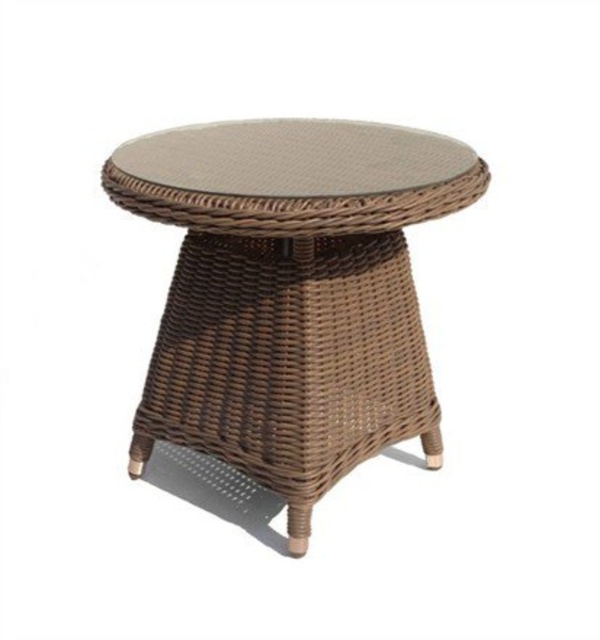
Question: Is brown woven side table at center to the right of brown woven table at center from the viewer's perspective?

Choices:
 (A) yes
 (B) no

Answer: (B)

Question: Which point appears farthest from the camera in this image?

Choices:
 (A) (426, 132)
 (B) (112, 161)

Answer: (A)

Question: Does brown woven side table at center appear over brown woven table at center?

Choices:
 (A) yes
 (B) no

Answer: (B)

Question: Is the position of brown woven side table at center less distant than that of brown woven table at center?

Choices:
 (A) yes
 (B) no

Answer: (B)